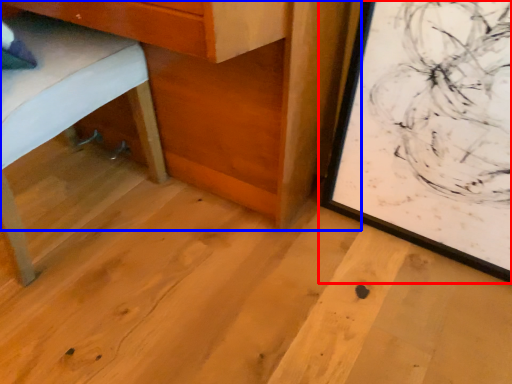
Question: Which point is further to the camera, picture frame (highlighted by a red box) or table (highlighted by a blue box)?

Choices:
 (A) picture frame
 (B) table

Answer: (A)